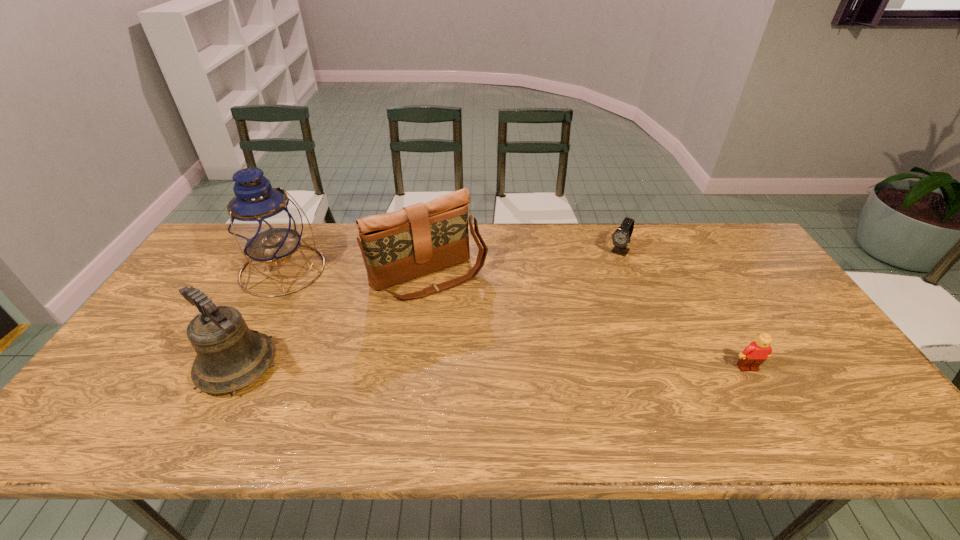
At what (x,y) coordinates should I click in order to perform the action: click on vacant point located between the lantern and the bell. Please return your answer as a coordinate pair (x, y). Looking at the image, I should click on (260, 318).

Where is `vacant space in between the fourth object from left to right and the bell`? vacant space in between the fourth object from left to right and the bell is located at coordinates (428, 309).

At what (x,y) coordinates should I click in order to perform the action: click on free point between the Lego and the watch. Please return your answer as a coordinate pair (x, y). Looking at the image, I should click on (684, 309).

This screenshot has height=540, width=960. Find the location of `free area in between the shoulder bag and the bell`. free area in between the shoulder bag and the bell is located at coordinates (333, 321).

What are the coordinates of `free space between the bell and the third object from right to left` in the screenshot? It's located at (333, 321).

At what (x,y) coordinates should I click in order to perform the action: click on empty space that is in between the Lego and the watch. Please return your answer as a coordinate pair (x, y). The height and width of the screenshot is (540, 960). Looking at the image, I should click on (684, 309).

Identify the location of the closest object to the bell. The image size is (960, 540). (263, 222).

Identify which object is the fourth nearest to the second object from right to left. Please provide its 2D coordinates. Your answer should be formatted as a tuple, i.e. [(x, y)], where the tuple contains the x and y coordinates of a point satisfying the conditions above.

[(230, 356)]

Image resolution: width=960 pixels, height=540 pixels. What are the coordinates of `vacant region that satisfies the following two spatial constraints: 1. on the back side of the bell; 2. on the left side of the shoulder bag` in the screenshot? It's located at (283, 277).

The height and width of the screenshot is (540, 960). In order to click on free spot that satisfies the following two spatial constraints: 1. on the back side of the second object from right to left; 2. on the left side of the tallest object in this screenshot , I will do `click(293, 252)`.